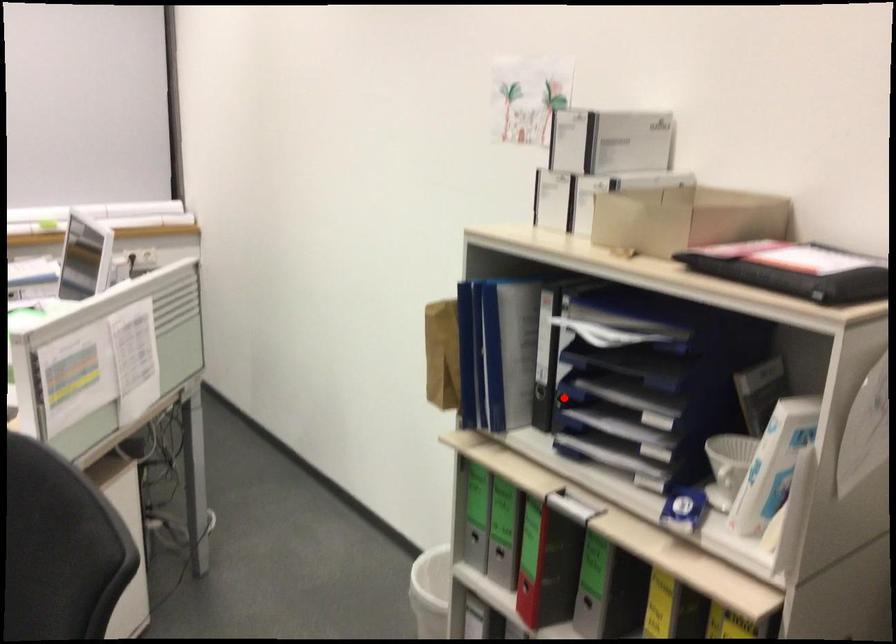
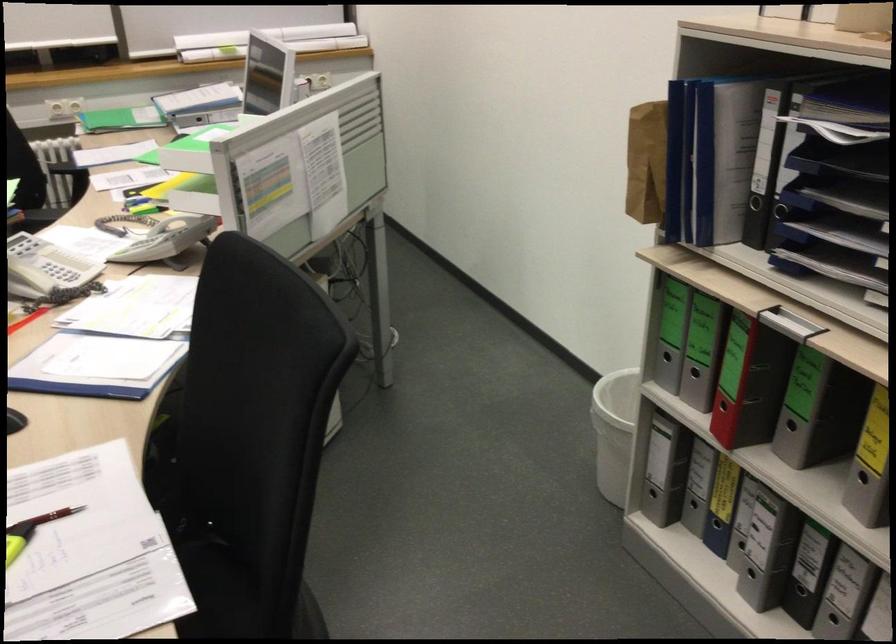
Question: I am providing you with two images of the same scene from different viewpoints. A red point is marked on the first image. At the location where the point appears in image 1, is it still visible in image 2?

Choices:
 (A) Yes
 (B) No

Answer: (A)